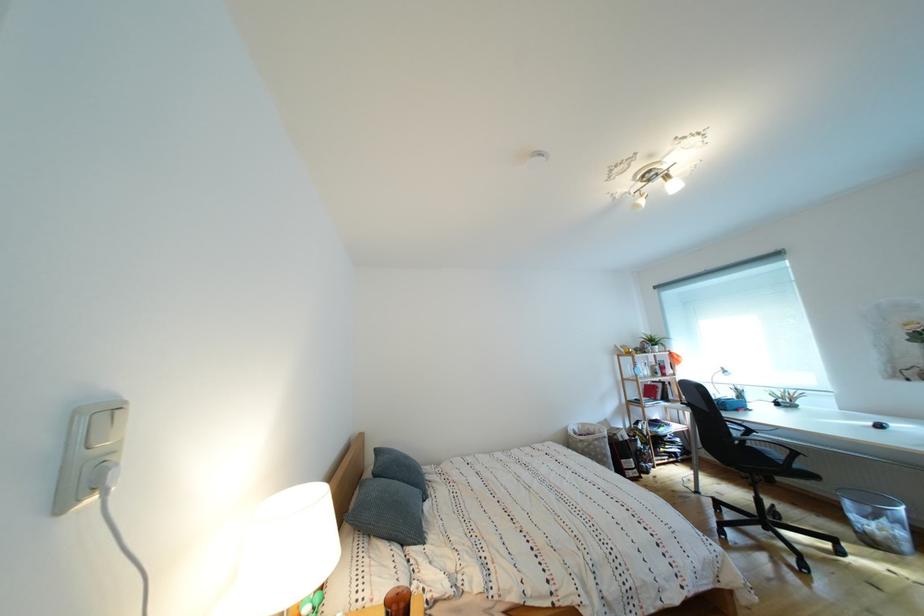
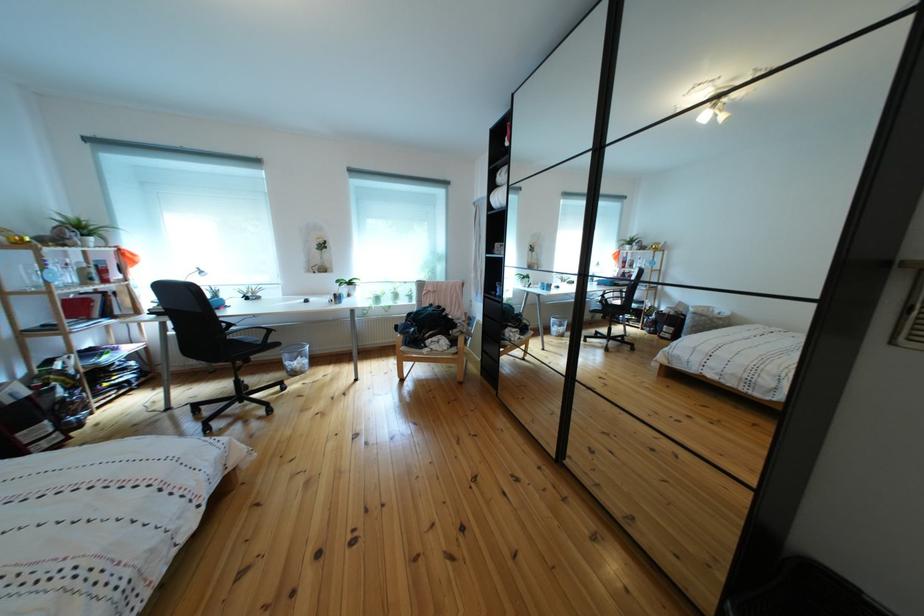
Find the pixel in the second image that matches point (858, 509) in the first image.

(297, 362)